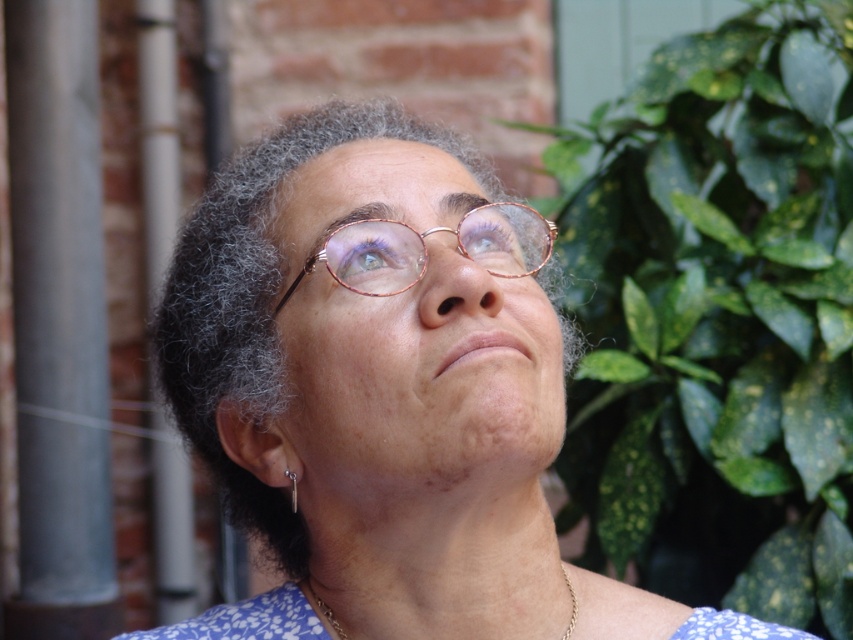
Question: Does purple matte eye at upper center appear on the right side of matte gold eye at upper center?

Choices:
 (A) no
 (B) yes

Answer: (A)

Question: Which point appears farthest from the camera in this image?

Choices:
 (A) (178, 337)
 (B) (601, 262)

Answer: (B)

Question: Is matte gold eye at upper center below gold chain necklace at center?

Choices:
 (A) yes
 (B) no

Answer: (B)

Question: Which point is farther to the camera?

Choices:
 (A) (337, 241)
 (B) (344, 122)
 (C) (486, 227)
 (D) (314, 596)

Answer: (B)

Question: Is the position of green leafy plant at right less distant than that of gold metallic glasses at center?

Choices:
 (A) no
 (B) yes

Answer: (A)

Question: Among these points, which one is nearest to the camera?

Choices:
 (A) (582, 486)
 (B) (576, 612)

Answer: (B)